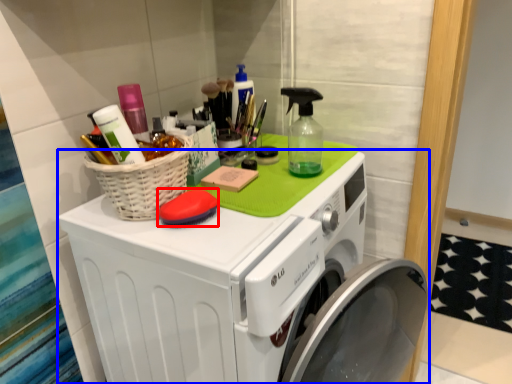
Question: Which object is further to the camera taking this photo, soap (highlighted by a red box) or washing machine (highlighted by a blue box)?

Choices:
 (A) soap
 (B) washing machine

Answer: (A)